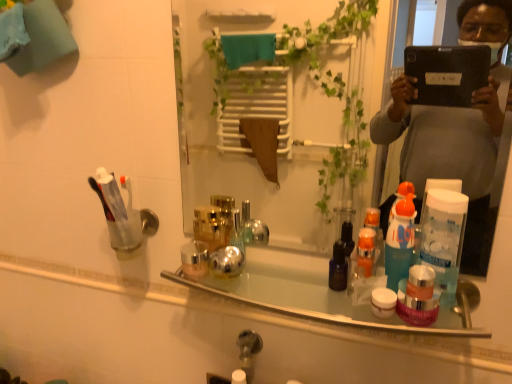
Question: Considering the relative sizes of clear glass mirror at center and shiny metallic bottles at center in the image provided, is clear glass mirror at center shorter than shiny metallic bottles at center?

Choices:
 (A) yes
 (B) no

Answer: (B)

Question: Does clear glass mirror at center have a smaller size compared to shiny metallic bottles at center?

Choices:
 (A) yes
 (B) no

Answer: (B)

Question: From a real-world perspective, is clear glass mirror at center located beneath shiny metallic bottles at center?

Choices:
 (A) no
 (B) yes

Answer: (A)

Question: Is the surface of clear glass mirror at center in direct contact with shiny metallic bottles at center?

Choices:
 (A) no
 (B) yes

Answer: (A)

Question: Is clear glass mirror at center positioned before shiny metallic bottles at center?

Choices:
 (A) no
 (B) yes

Answer: (B)

Question: Would you say clear plastic cup at left is inside or outside shiny metallic bottles at center?

Choices:
 (A) outside
 (B) inside

Answer: (A)

Question: Is point (120, 243) positioned closer to the camera than point (444, 317)?

Choices:
 (A) closer
 (B) farther

Answer: (B)

Question: Considering their positions, is clear plastic cup at left located in front of or behind shiny metallic bottles at center?

Choices:
 (A) behind
 (B) front

Answer: (A)

Question: Considering the relative positions of clear plastic cup at left and shiny metallic bottles at center in the image provided, is clear plastic cup at left to the left or to the right of shiny metallic bottles at center?

Choices:
 (A) left
 (B) right

Answer: (A)

Question: Considering the positions of clear plastic cup at left and clear glass mirror at center in the image, is clear plastic cup at left taller or shorter than clear glass mirror at center?

Choices:
 (A) tall
 (B) short

Answer: (B)

Question: In the image, is clear plastic cup at left on the left side or the right side of clear glass mirror at center?

Choices:
 (A) right
 (B) left

Answer: (B)

Question: Is clear plastic cup at left in front of or behind clear glass mirror at center in the image?

Choices:
 (A) behind
 (B) front

Answer: (A)

Question: Does point (145, 218) appear closer or farther from the camera than point (203, 26)?

Choices:
 (A) closer
 (B) farther

Answer: (A)

Question: Is shiny metallic bottles at center wider or thinner than clear glass mirror at center?

Choices:
 (A) wide
 (B) thin

Answer: (A)

Question: Is shiny metallic bottles at center spatially inside clear glass mirror at center, or outside of it?

Choices:
 (A) outside
 (B) inside

Answer: (A)